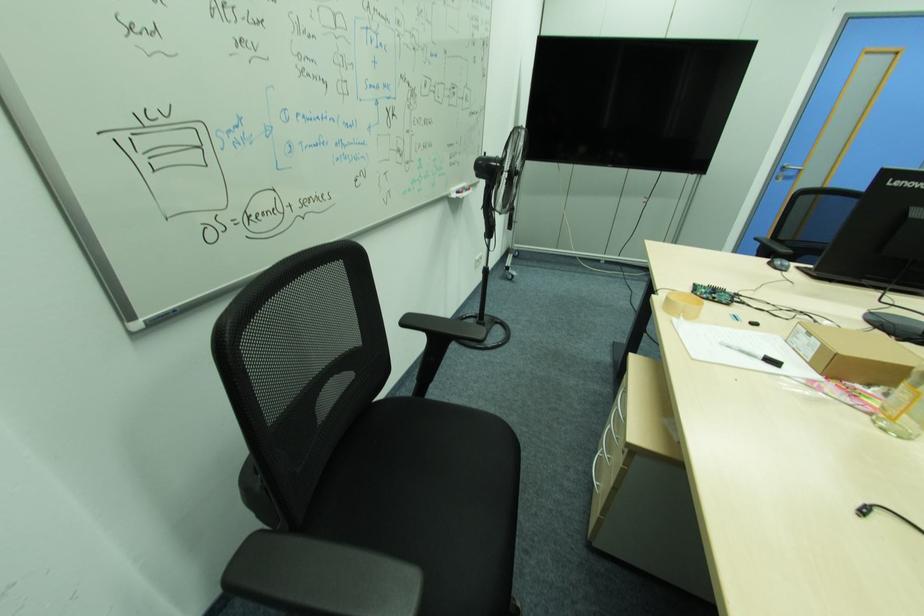
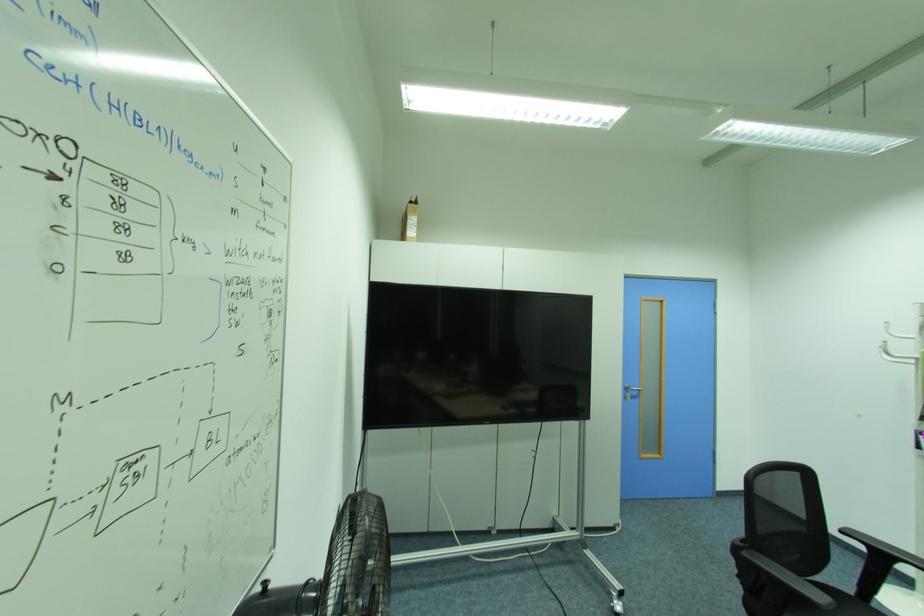
Where in the second image is the point corresponding to (x=784, y=171) from the first image?

(629, 390)